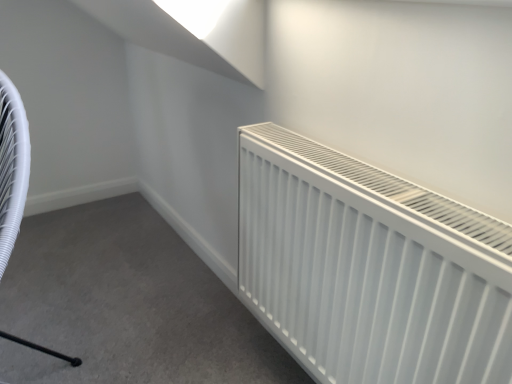
Question: Could white matte radiator at right be considered to be inside white plastic swivel chair at left?

Choices:
 (A) yes
 (B) no

Answer: (B)

Question: From a real-world perspective, is white plastic swivel chair at left on top of white matte radiator at right?

Choices:
 (A) no
 (B) yes

Answer: (B)

Question: Considering the relative sizes of white plastic swivel chair at left and white matte radiator at right in the image provided, is white plastic swivel chair at left wider than white matte radiator at right?

Choices:
 (A) no
 (B) yes

Answer: (B)

Question: Would you say white plastic swivel chair at left is outside white matte radiator at right?

Choices:
 (A) no
 (B) yes

Answer: (B)

Question: Does white plastic swivel chair at left come in front of white matte radiator at right?

Choices:
 (A) no
 (B) yes

Answer: (B)

Question: From a real-world perspective, is white plastic swivel chair at left under white matte radiator at right?

Choices:
 (A) no
 (B) yes

Answer: (A)

Question: From the image's perspective, does white matte radiator at right appear lower than white plastic swivel chair at left?

Choices:
 (A) yes
 (B) no

Answer: (A)

Question: Is white matte radiator at right positioned in front of white plastic swivel chair at left?

Choices:
 (A) yes
 (B) no

Answer: (B)

Question: Is white matte radiator at right positioned behind white plastic swivel chair at left?

Choices:
 (A) yes
 (B) no

Answer: (A)

Question: Is white matte radiator at right completely or partially outside of white plastic swivel chair at left?

Choices:
 (A) no
 (B) yes

Answer: (B)

Question: Is white matte radiator at right far from white plastic swivel chair at left?

Choices:
 (A) no
 (B) yes

Answer: (A)

Question: Considering the relative sizes of white matte radiator at right and white plastic swivel chair at left in the image provided, is white matte radiator at right taller than white plastic swivel chair at left?

Choices:
 (A) no
 (B) yes

Answer: (A)

Question: Considering their positions, is white matte radiator at right located in front of or behind white plastic swivel chair at left?

Choices:
 (A) front
 (B) behind

Answer: (B)